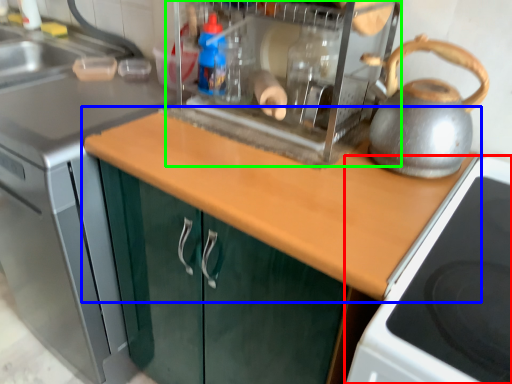
Question: Which object is positioned farthest from gas stove (highlighted by a red box)? Select from countertop (highlighted by a blue box) and appliance (highlighted by a green box).

Choices:
 (A) countertop
 (B) appliance

Answer: (B)